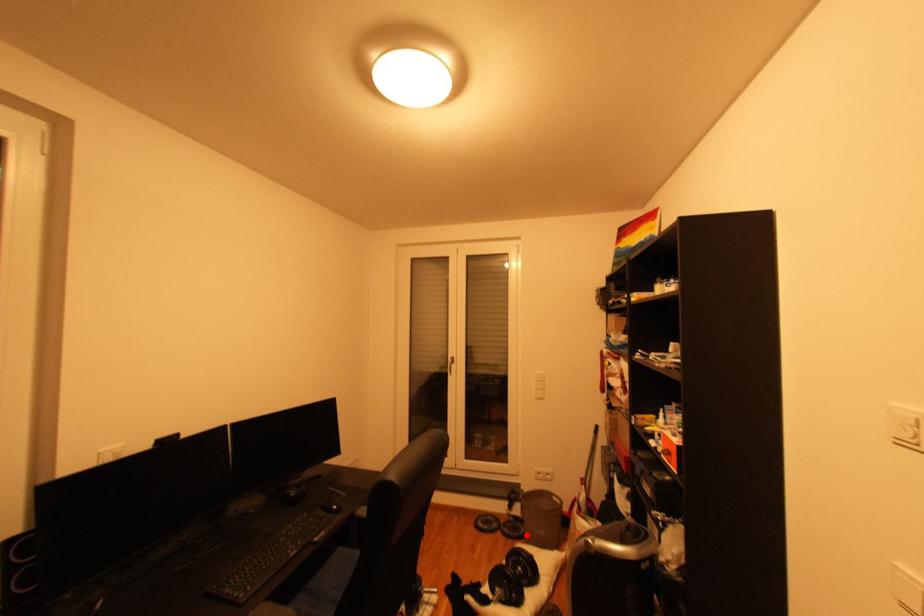
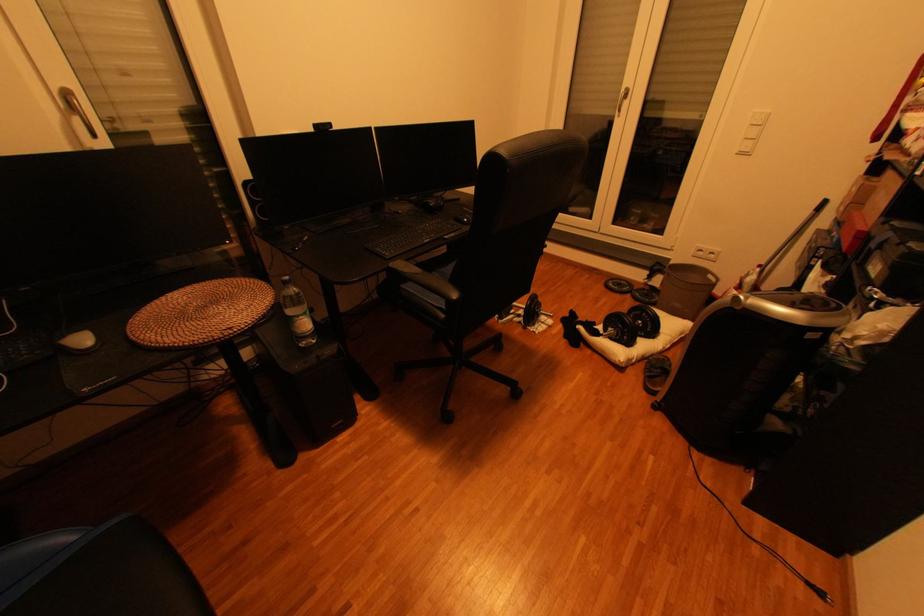
Question: I am providing you with two images of the same scene from different viewpoints. Image1 has a red point marked. In image2, the corresponding 3D location appears at what relative position? Reply with the corresponding letter.

Choices:
 (A) Closer
 (B) Farther

Answer: (B)